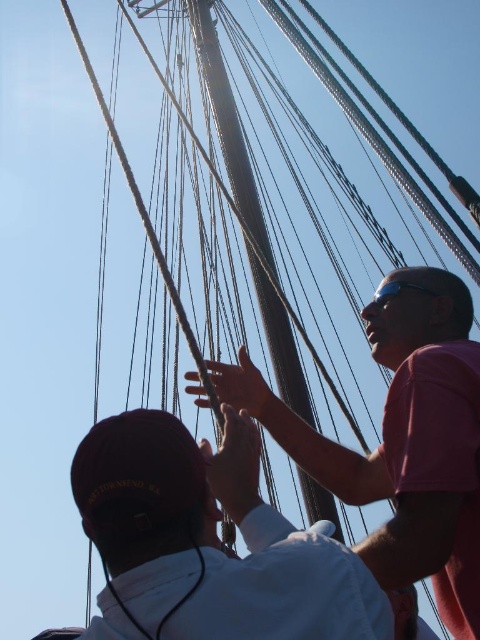
You are on a ship and need to determine the relative positions of two crew members. The white matte shirt at center and the pink matte shirt at upper right are both visible. Which crew member is positioned lower in the image?

The white matte shirt at center is positioned lower in the image because it has a lesser height compared to the pink matte shirt at upper right.

You are a sailor on deck and need to secure a rope. You have the white matte shirt at center and the smooth wood mast at center in your view. Which object is shorter in height?

The white matte shirt at center is not as tall as the smooth wood mast at center, so the white matte shirt at center is shorter in height.